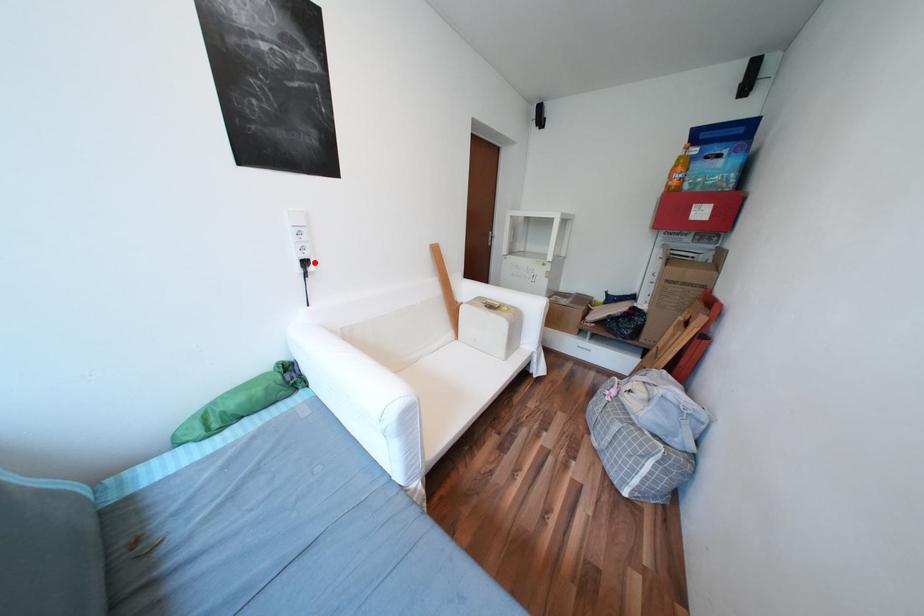
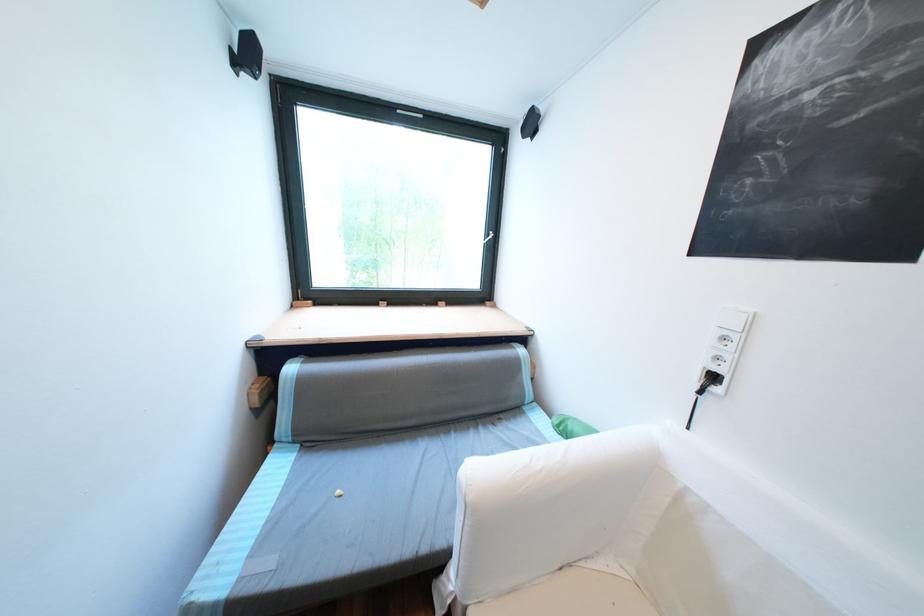
Locate, in the second image, the point that corresponds to the highlighted location in the first image.

(723, 378)